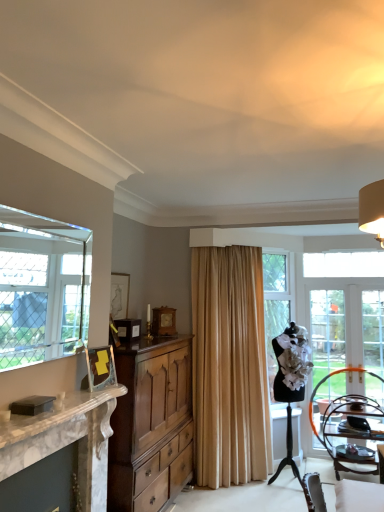
Question: Would you say white marble fireplace at left is a long distance from wooden chair at lower right?

Choices:
 (A) no
 (B) yes

Answer: (B)

Question: From the image's perspective, does white marble fireplace at left appear higher than wooden chair at lower right?

Choices:
 (A) no
 (B) yes

Answer: (B)

Question: Does white marble fireplace at left appear on the right side of wooden chair at lower right?

Choices:
 (A) yes
 (B) no

Answer: (B)

Question: Is white marble fireplace at left bigger than wooden chair at lower right?

Choices:
 (A) no
 (B) yes

Answer: (A)

Question: Considering the relative sizes of white marble fireplace at left and wooden chair at lower right in the image provided, is white marble fireplace at left taller than wooden chair at lower right?

Choices:
 (A) no
 (B) yes

Answer: (A)

Question: From the image's perspective, is white marble fireplace at left under wooden chair at lower right?

Choices:
 (A) no
 (B) yes

Answer: (A)

Question: Is white marble fireplace at left closer to camera compared to beige fabric curtain at center?

Choices:
 (A) yes
 (B) no

Answer: (A)

Question: Considering the relative positions of white marble fireplace at left and beige fabric curtain at center in the image provided, is white marble fireplace at left to the left of beige fabric curtain at center from the viewer's perspective?

Choices:
 (A) yes
 (B) no

Answer: (A)

Question: Does white marble fireplace at left have a lesser width compared to beige fabric curtain at center?

Choices:
 (A) no
 (B) yes

Answer: (B)

Question: From a real-world perspective, is white marble fireplace at left under beige fabric curtain at center?

Choices:
 (A) yes
 (B) no

Answer: (A)

Question: From the image's perspective, is white marble fireplace at left under beige fabric curtain at center?

Choices:
 (A) no
 (B) yes

Answer: (B)

Question: Is white marble fireplace at left with beige fabric curtain at center?

Choices:
 (A) no
 (B) yes

Answer: (A)

Question: Is clear glass window at left directly adjacent to clear glass door at right?

Choices:
 (A) no
 (B) yes

Answer: (A)